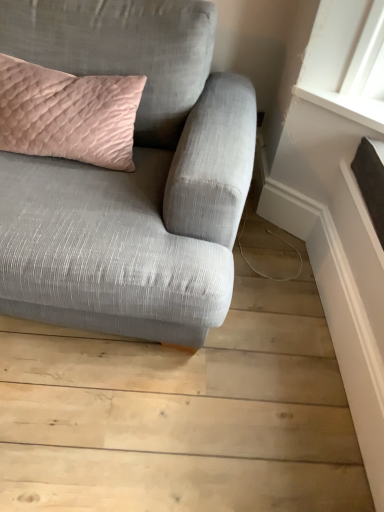
This screenshot has width=384, height=512. Describe the element at coordinates (68, 114) in the screenshot. I see `pink quilted cushion at upper left` at that location.

This screenshot has width=384, height=512. In order to click on pink quilted cushion at upper left in this screenshot , I will do `click(68, 114)`.

What do you see at coordinates (130, 177) in the screenshot?
I see `textured gray couch at upper left` at bounding box center [130, 177].

In order to face textured gray couch at upper left, should I rotate leftwards or rightwards?

Turn left by 15.293 degrees to look at textured gray couch at upper left.

Where is `textured gray couch at upper left`? This screenshot has width=384, height=512. textured gray couch at upper left is located at coordinates (130, 177).

Locate an element on the screen. Image resolution: width=384 pixels, height=512 pixels. pink quilted cushion at upper left is located at coordinates (68, 114).

Considering the relative positions of textured gray couch at upper left and pink quilted cushion at upper left in the image provided, is textured gray couch at upper left to the left or to the right of pink quilted cushion at upper left?

From the image, it's evident that textured gray couch at upper left is to the right of pink quilted cushion at upper left.

Is the position of textured gray couch at upper left more distant than that of pink quilted cushion at upper left?

No, textured gray couch at upper left is closer to the camera.

Is point (217, 257) farther from viewer compared to point (102, 162)?

No.

From the image's perspective, is textured gray couch at upper left located beneath pink quilted cushion at upper left?

Yes.

From a real-world perspective, is textured gray couch at upper left above or below pink quilted cushion at upper left?

textured gray couch at upper left is below pink quilted cushion at upper left.

Which of these two, textured gray couch at upper left or pink quilted cushion at upper left, is thinner?

With smaller width is pink quilted cushion at upper left.

Can you confirm if textured gray couch at upper left is taller than pink quilted cushion at upper left?

Yes, textured gray couch at upper left is taller than pink quilted cushion at upper left.

Considering the sizes of objects textured gray couch at upper left and pink quilted cushion at upper left in the image provided, who is bigger, textured gray couch at upper left or pink quilted cushion at upper left?

Bigger between the two is textured gray couch at upper left.

Which is correct: textured gray couch at upper left is inside pink quilted cushion at upper left, or outside of it?

textured gray couch at upper left is outside pink quilted cushion at upper left.

Is the surface of textured gray couch at upper left in direct contact with pink quilted cushion at upper left?

No, textured gray couch at upper left is not with pink quilted cushion at upper left.

Is textured gray couch at upper left facing away from pink quilted cushion at upper left?

That's right, textured gray couch at upper left is facing away from pink quilted cushion at upper left.

Measure the distance from textured gray couch at upper left to pink quilted cushion at upper left.

A distance of 8.70 inches exists between textured gray couch at upper left and pink quilted cushion at upper left.

Find the location of a particular element. This screenshot has height=512, width=384. pillow located on the left of textured gray couch at upper left is located at coordinates (68, 114).

Between pink quilted cushion at upper left and textured gray couch at upper left, which one appears on the right side from the viewer's perspective?

textured gray couch at upper left is more to the right.

Is pink quilted cushion at upper left behind textured gray couch at upper left?

Yes.

Which is behind, point (117, 151) or point (97, 276)?

The point (117, 151) is farther from the camera.

From the image's perspective, which is above, pink quilted cushion at upper left or textured gray couch at upper left?

pink quilted cushion at upper left appears higher in the image.

From a real-world perspective, which object rests below the other?

From a 3D spatial view, textured gray couch at upper left is below.

Considering the sizes of objects pink quilted cushion at upper left and textured gray couch at upper left in the image provided, who is wider, pink quilted cushion at upper left or textured gray couch at upper left?

With larger width is textured gray couch at upper left.

In the scene shown: Can you confirm if pink quilted cushion at upper left is taller than textured gray couch at upper left?

Incorrect, the height of pink quilted cushion at upper left is not larger of that of textured gray couch at upper left.

Between pink quilted cushion at upper left and textured gray couch at upper left, which one has larger size?

With larger size is textured gray couch at upper left.

Is pink quilted cushion at upper left completely or partially outside of textured gray couch at upper left?

That's incorrect, pink quilted cushion at upper left is not completely outside textured gray couch at upper left.

Is pink quilted cushion at upper left beside textured gray couch at upper left?

No.

Is pink quilted cushion at upper left oriented away from textured gray couch at upper left?

Yes, pink quilted cushion at upper left is positioned with its back facing textured gray couch at upper left.

How different are the orientations of pink quilted cushion at upper left and textured gray couch at upper left in degrees?

0.000172 degrees.

Locate an element on the screen. The width and height of the screenshot is (384, 512). studio couch below the pink quilted cushion at upper left (from the image's perspective) is located at coordinates (130, 177).

The image size is (384, 512). I want to click on pillow located behind the textured gray couch at upper left, so click(x=68, y=114).

Where is `studio couch below the pink quilted cushion at upper left (from a real-world perspective)`? The height and width of the screenshot is (512, 384). studio couch below the pink quilted cushion at upper left (from a real-world perspective) is located at coordinates (130, 177).